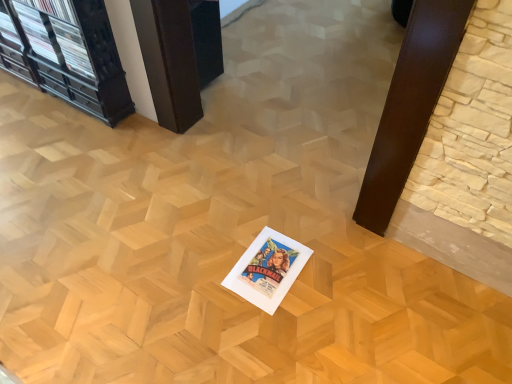
This screenshot has width=512, height=384. I want to click on wooden at center, so click(179, 55).

Describe the element at coordinates (179, 55) in the screenshot. The height and width of the screenshot is (384, 512). I see `wooden at center` at that location.

You are a GUI agent. You are given a task and a screenshot of the screen. Output one action in this format:
    pyautogui.click(x=<x>, y=<y>)
    Task: Click on the white paper at center
    
    Given the screenshot: What is the action you would take?
    pyautogui.click(x=267, y=269)

The width and height of the screenshot is (512, 384). What do you see at coordinates (267, 269) in the screenshot?
I see `white paper at center` at bounding box center [267, 269].

Locate an element on the screen. The image size is (512, 384). wooden at center is located at coordinates (179, 55).

Consider the image. Is white paper at center to the left of wooden at center from the viewer's perspective?

In fact, white paper at center is to the right of wooden at center.

Is white paper at center in front of or behind wooden at center in the image?

white paper at center is positioned closer to the viewer than wooden at center.

Does point (242, 279) appear closer or farther from the camera than point (133, 4)?

Point (242, 279) appears to be closer to the viewer than point (133, 4).

From the image's perspective, is white paper at center positioned above or below wooden at center?

white paper at center is below wooden at center.

From a real-world perspective, is white paper at center positioned under wooden at center based on gravity?

Yes, from a real-world perspective, white paper at center is under wooden at center.

Can you confirm if white paper at center is wider than wooden at center?

No, white paper at center is not wider than wooden at center.

Considering the sizes of objects white paper at center and wooden at center in the image provided, who is taller, white paper at center or wooden at center?

With more height is wooden at center.

Considering the sizes of objects white paper at center and wooden at center in the image provided, who is smaller, white paper at center or wooden at center?

Smaller between the two is white paper at center.

Can wooden at center be found inside white paper at center?

Definitely not — wooden at center is not inside white paper at center.

In the scene shown: Does white paper at center touch wooden at center?

No, white paper at center is not beside wooden at center.

Could you tell me if white paper at center is turned towards wooden at center?

No, white paper at center is not turned towards wooden at center.

Can you tell me how much white paper at center and wooden at center differ in facing direction?

The facing directions of white paper at center and wooden at center are 2.95 degrees apart.

How much distance is there between white paper at center and wooden at center?

white paper at center is 32.97 inches from wooden at center.

Locate an element on the screen. The width and height of the screenshot is (512, 384). postcard that is under the wooden at center (from a real-world perspective) is located at coordinates (267, 269).

Which object is positioned more to the right, wooden at center or white paper at center?

From the viewer's perspective, white paper at center appears more on the right side.

Is wooden at center closer to the viewer compared to white paper at center?

No.

Which point is more distant from viewer, (x=138, y=24) or (x=257, y=278)?

The point (x=138, y=24) is farther from the camera.

From the image's perspective, between wooden at center and white paper at center, who is located below?

white paper at center, from the image's perspective.

From a real-world perspective, is wooden at center under white paper at center?

No, from a real-world perspective, wooden at center is not under white paper at center.

Which of these two, wooden at center or white paper at center, is wider?

wooden at center is wider.

Which of these two, wooden at center or white paper at center, stands shorter?

white paper at center is shorter.

Based on their sizes in the image, would you say wooden at center is bigger or smaller than white paper at center?

In the image, wooden at center appears to be larger than white paper at center.

Is wooden at center outside of white paper at center?

Yes.

Consider the image. Is wooden at center positioned far away from white paper at center?

No, wooden at center is not far away from white paper at center.

Is wooden at center aimed at white paper at center?

No, wooden at center is not aimed at white paper at center.

What are the coordinates of `postcard to the right of wooden at center` in the screenshot? It's located at pyautogui.click(x=267, y=269).

In order to click on postcard on the right of wooden at center in this screenshot , I will do `click(267, 269)`.

Where is `postcard below the wooden at center (from a real-world perspective)`? postcard below the wooden at center (from a real-world perspective) is located at coordinates (267, 269).